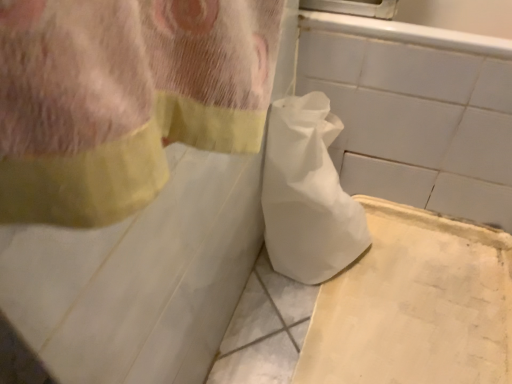
The width and height of the screenshot is (512, 384). Identify the location of white cardboard at lower right. (415, 305).

This screenshot has height=384, width=512. What do you see at coordinates (415, 305) in the screenshot? I see `white cardboard at lower right` at bounding box center [415, 305].

What is the approximate width of white paper bag at center?

white paper bag at center is 29.61 centimeters wide.

Image resolution: width=512 pixels, height=384 pixels. What do you see at coordinates (307, 194) in the screenshot?
I see `white paper bag at center` at bounding box center [307, 194].

Locate an element on the screen. This screenshot has width=512, height=384. white paper bag at center is located at coordinates (307, 194).

Identify the location of white cardboard at lower right. (415, 305).

Is white paper bag at center at the left side of white cardboard at lower right?

Yes.

Which object is further away from the camera, white paper bag at center or white cardboard at lower right?

white cardboard at lower right is further away from the camera.

Which is farther, (x=307, y=119) or (x=381, y=208)?

The point (x=381, y=208) is more distant.

From the image's perspective, does white paper bag at center appear higher than white cardboard at lower right?

Yes, from the image's perspective, white paper bag at center is on top of white cardboard at lower right.

From a real-world perspective, which object rests below the other?

In real-world perspective, white cardboard at lower right is lower.

Does white paper bag at center have a lesser width compared to white cardboard at lower right?

Yes.

Does white paper bag at center have a greater height compared to white cardboard at lower right?

Yes.

Does white paper bag at center have a larger size compared to white cardboard at lower right?

Yes, white paper bag at center is bigger than white cardboard at lower right.

Is white paper bag at center spatially inside white cardboard at lower right, or outside of it?

white paper bag at center is located beyond the bounds of white cardboard at lower right.

Are white paper bag at center and white cardboard at lower right located far from each other?

That's not correct — white paper bag at center is a little close to white cardboard at lower right.

Is white paper bag at center aimed at white cardboard at lower right?

Yes, white paper bag at center faces towards white cardboard at lower right.

Can you tell me how much white paper bag at center and white cardboard at lower right differ in facing direction?

The angular difference between white paper bag at center and white cardboard at lower right is 90.6 degrees.

Find the location of a particular element. cardboard that is behind the white paper bag at center is located at coordinates (415, 305).

Looking at this image, considering the relative positions of white cardboard at lower right and white paper bag at center in the image provided, is white cardboard at lower right to the left or to the right of white paper bag at center?

white cardboard at lower right is positioned on white paper bag at center's right side.

In the image, is white cardboard at lower right positioned in front of or behind white paper bag at center?

white cardboard at lower right is behind white paper bag at center.

Considering the points (385, 352) and (313, 127), which point is in front, point (385, 352) or point (313, 127)?

Positioned in front is point (313, 127).

From the image's perspective, is white cardboard at lower right located above white paper bag at center?

No, from the image's perspective, white cardboard at lower right is not above white paper bag at center.

From a real-world perspective, between white cardboard at lower right and white paper bag at center, who is vertically higher?

white paper bag at center, from a real-world perspective.

Can you confirm if white cardboard at lower right is thinner than white paper bag at center?

In fact, white cardboard at lower right might be wider than white paper bag at center.

Is white cardboard at lower right shorter than white paper bag at center?

Correct, white cardboard at lower right is not as tall as white paper bag at center.

In the scene shown: Does white cardboard at lower right have a smaller size compared to white paper bag at center?

Yes.

Consider the image. Is white cardboard at lower right not within white paper bag at center?

That's correct, white cardboard at lower right is outside of white paper bag at center.

Does white cardboard at lower right touch white paper bag at center?

white cardboard at lower right is not next to white paper bag at center, and they're not touching.

Is white cardboard at lower right facing away from white paper bag at center?

No, white paper bag at center is not at the back of white cardboard at lower right.

How distant is white cardboard at lower right from white paper bag at center?

white cardboard at lower right is 9.36 inches from white paper bag at center.

The width and height of the screenshot is (512, 384). In order to click on toilet paper lying in front of the white cardboard at lower right in this screenshot , I will do `click(307, 194)`.

In order to click on cardboard located below the white paper bag at center (from the image's perspective) in this screenshot , I will do `click(415, 305)`.

The width and height of the screenshot is (512, 384). Identify the location of cardboard lying behind the white paper bag at center. (415, 305).